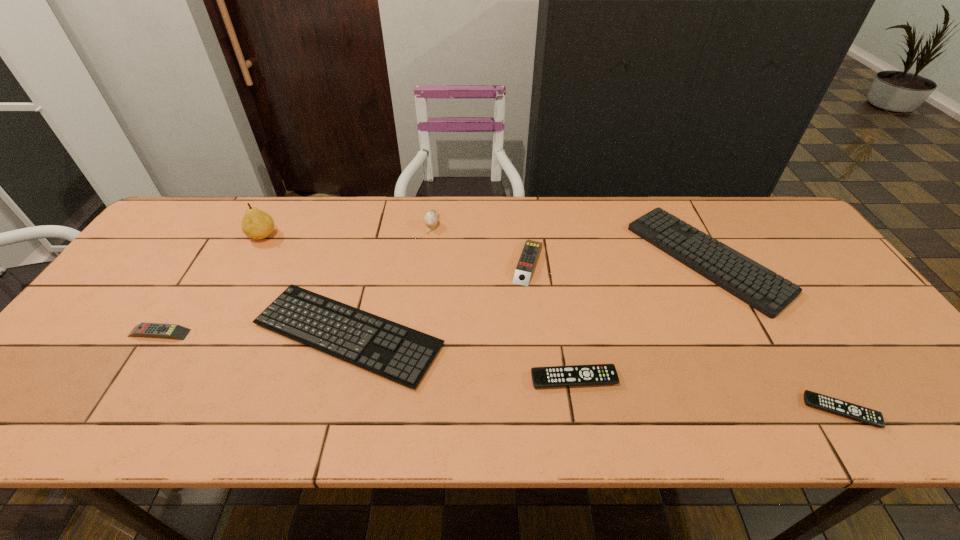
Where is `the left black remote control`? the left black remote control is located at coordinates (597, 374).

Image resolution: width=960 pixels, height=540 pixels. Identify the location of the bigger black remote control. (597, 374).

The width and height of the screenshot is (960, 540). Identify the location of the smaller black remote control. (859, 413).

At what (x,y) coordinates should I click in order to perform the action: click on the shortest object. Please return your answer as a coordinate pair (x, y). Image resolution: width=960 pixels, height=540 pixels. Looking at the image, I should click on (859, 413).

Image resolution: width=960 pixels, height=540 pixels. Find the location of `vacant region located 0.090m on the left of the pear`. vacant region located 0.090m on the left of the pear is located at coordinates (218, 236).

The image size is (960, 540). Identify the location of vacant space positioned 0.340m on the shell of the escargot. (420, 320).

Locate an element on the screen. The width and height of the screenshot is (960, 540). vacant point located 0.350m on the left of the taller computer keyboard is located at coordinates (517, 259).

Find the location of a particular element. The width and height of the screenshot is (960, 540). vacant space located 0.330m on the right of the farther yellow remote control is located at coordinates (660, 262).

I want to click on vacant area located on the back of the left yellow remote control, so click(x=200, y=270).

Identify the location of vacant space located on the left of the black computer keyboard. The height and width of the screenshot is (540, 960). (177, 334).